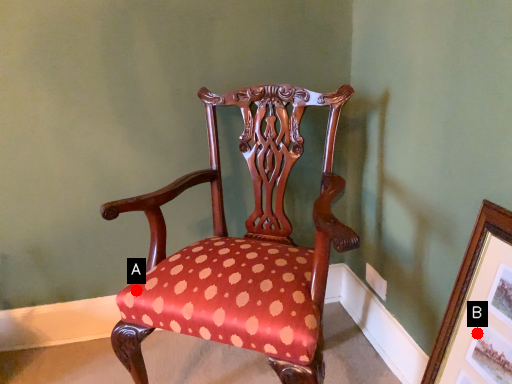
Question: Two points are circled on the image, labeled by A and B beside each circle. Among these points, which one is nearest to the camera?

Choices:
 (A) A is closer
 (B) B is closer

Answer: (B)